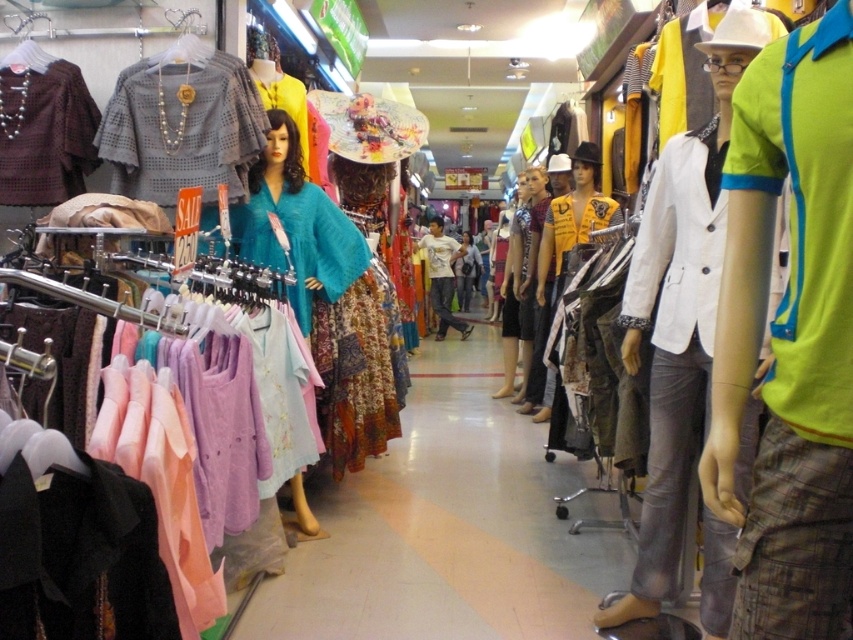
Question: Which of these objects is positioned closest to the white matte blazer at center?

Choices:
 (A) white cotton shirt at center
 (B) teal fabric dress at center
 (C) neon green polo shirt at center-right

Answer: (C)

Question: Is neon green polo shirt at center-right closer to camera compared to white matte blazer at center?

Choices:
 (A) yes
 (B) no

Answer: (A)

Question: Is the position of matte gray blouse at center more distant than that of white cotton shirt at center?

Choices:
 (A) yes
 (B) no

Answer: (B)

Question: Considering the real-world distances, which object is closest to the floral fabric dress at center?

Choices:
 (A) matte gray blouse at center
 (B) white matte blazer at center
 (C) white cotton shirt at center

Answer: (C)

Question: Does teal fabric dress at center appear under white cotton shirt at center?

Choices:
 (A) no
 (B) yes

Answer: (B)

Question: Which object appears farthest from the camera in this image?

Choices:
 (A) matte gray blouse at center
 (B) neon green polo shirt at center-right
 (C) teal fabric dress at center

Answer: (C)